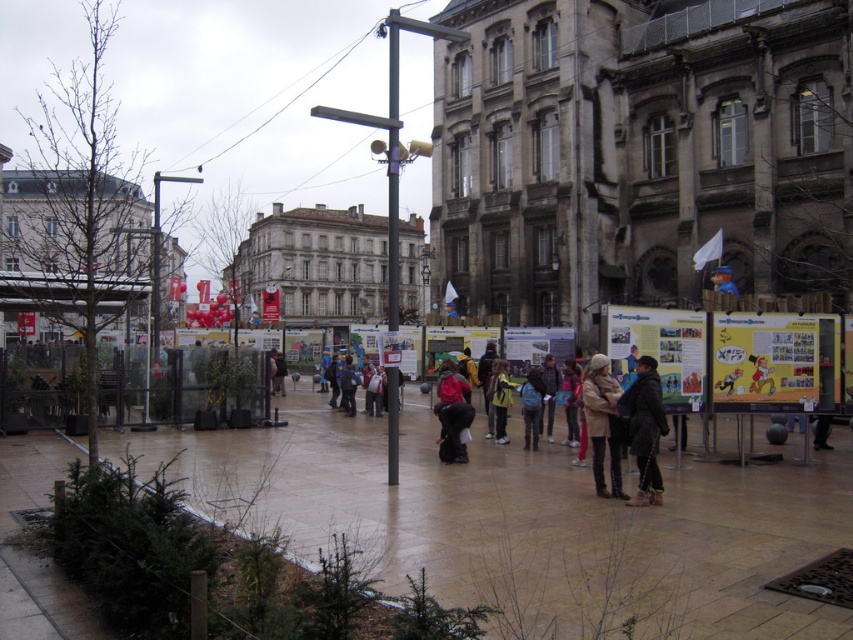
You are standing in the plaza and want to step onto the brown stone pavement at lower center. Is the black textured coat at center in your way?

The brown stone pavement at lower center is closer to the viewer than the black textured coat at center, so the black textured coat at center is behind the pavement and not blocking your path. You can step onto the brown stone pavement at lower center without any obstruction.

You are a photographer trying to capture a clear shot of the tan leather jacket at center and the blue fabric backpack at center. Since both are in the same area, you need to adjust your camera angle to ensure both are fully visible. Which object might require you to zoom out more to include its entire width in the frame?

The tan leather jacket at center might be wider than the blue fabric backpack at center, so you might need to zoom out more to include the entire width of the tan leather jacket at center.